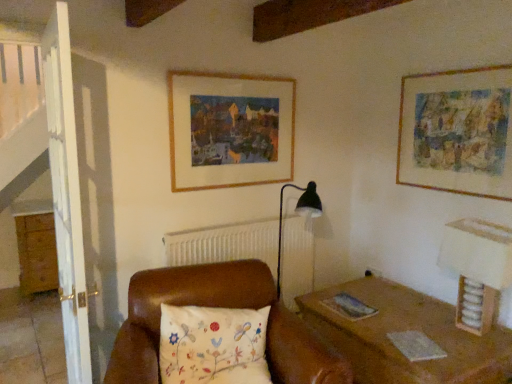
The image size is (512, 384). Find the location of `free spot above wooden table lamp at right (from a real-world perspective)`. free spot above wooden table lamp at right (from a real-world perspective) is located at coordinates tap(472, 229).